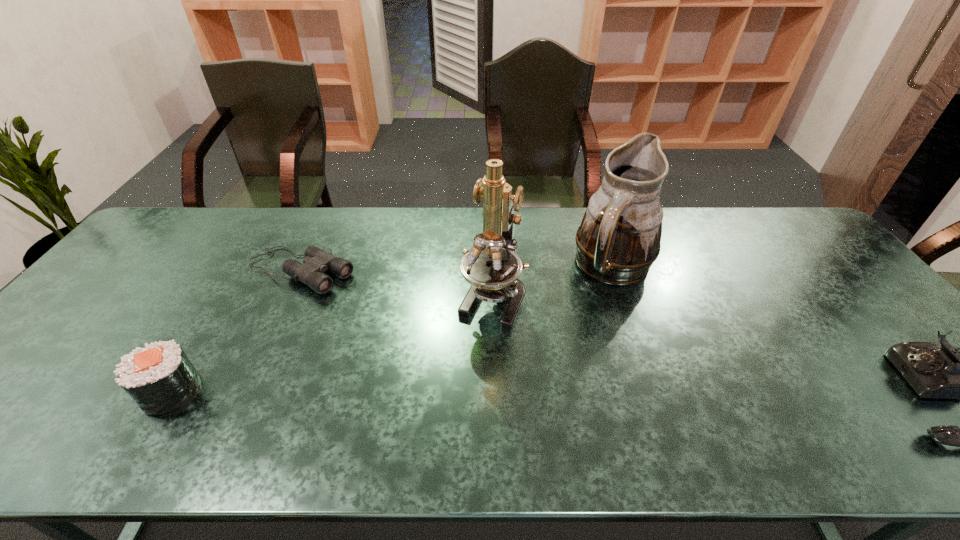
The width and height of the screenshot is (960, 540). Identify the location of blank space located 0.330m from the spout of the fourth object from left to right. (683, 406).

Where is `vacant space positioned 0.330m from the spout of the fourth object from left to right`? This screenshot has width=960, height=540. vacant space positioned 0.330m from the spout of the fourth object from left to right is located at coordinates (683, 406).

The height and width of the screenshot is (540, 960). Find the location of `free point located 0.170m at the eyepiece of the microscope`. free point located 0.170m at the eyepiece of the microscope is located at coordinates (456, 382).

Locate an element on the screen. This screenshot has width=960, height=540. vacant space located 0.100m at the eyepiece of the microscope is located at coordinates (467, 359).

In order to click on free space located at the eyepiece of the microscope in this screenshot , I will do `click(456, 382)`.

The height and width of the screenshot is (540, 960). I want to click on binoculars that is at the far edge, so click(316, 262).

I want to click on pitcher situated at the far edge, so click(618, 240).

Image resolution: width=960 pixels, height=540 pixels. I want to click on object present at the near edge, so click(159, 377).

In the image, there is a desktop. At what (x,y) coordinates should I click in order to perform the action: click on vacant space at the far edge. Please return your answer as a coordinate pair (x, y). Looking at the image, I should click on (292, 217).

The width and height of the screenshot is (960, 540). I want to click on free spot at the near edge of the desktop, so click(266, 381).